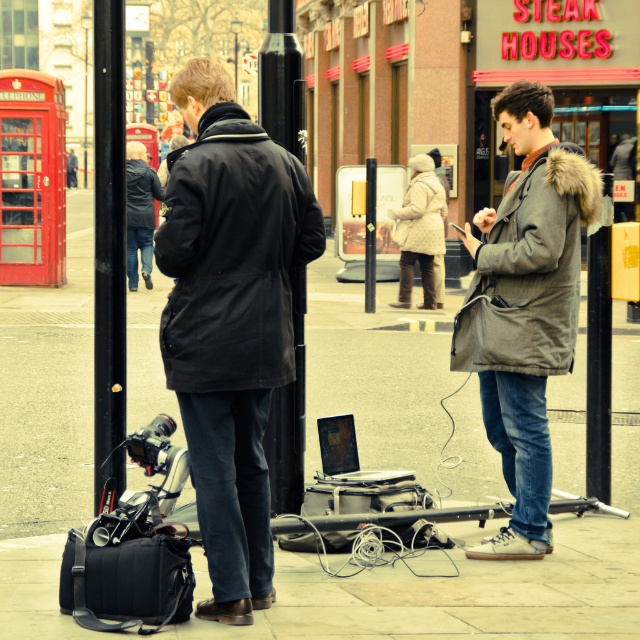
Question: Which object is positioned farthest from the gray fur-lined coat at right?

Choices:
 (A) silver metallic laptop at center
 (B) black metal pole at center

Answer: (B)

Question: Which point is farther to the camera?

Choices:
 (A) (547, 340)
 (B) (280, 406)
 (C) (115, 346)
 (D) (340, 474)

Answer: (D)

Question: Is black metal pole at center to the left of silver metallic laptop at center from the viewer's perspective?

Choices:
 (A) no
 (B) yes

Answer: (B)

Question: Which is farther from the gray fur-lined coat at right?

Choices:
 (A) black metal pole at center
 (B) silver metallic laptop at center
 (C) dark matte coat at center

Answer: (A)

Question: Does gray fur-lined coat at right appear under silver metallic laptop at center?

Choices:
 (A) no
 (B) yes

Answer: (A)

Question: Is gray fur-lined coat at right wider than black smooth pole at center?

Choices:
 (A) yes
 (B) no

Answer: (A)